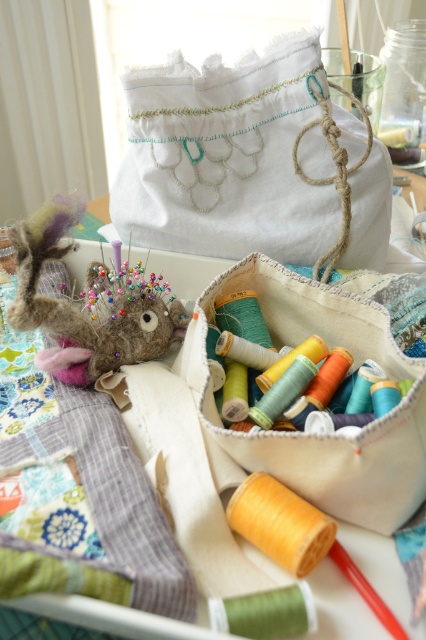
Who is positioned more to the left, white fabric pouch at upper center or fuzzy brown stuffed animal at left?

fuzzy brown stuffed animal at left is more to the left.

Between white fabric pouch at upper center and fuzzy brown stuffed animal at left, which one has less height?

With less height is fuzzy brown stuffed animal at left.

Between point (167, 106) and point (14, 236), which one is positioned behind?

The point (167, 106) is behind.

Where is `white fabric pouch at upper center`? This screenshot has width=426, height=640. white fabric pouch at upper center is located at coordinates (252, 163).

Does point (293, 300) come farther from viewer compared to point (43, 225)?

Yes, it is.

At what (x,y) coordinates should I click in order to perform the action: click on canvas spools at center. Please return your answer as a coordinate pair (x, y). This screenshot has width=426, height=640. Looking at the image, I should click on (319, 436).

This screenshot has width=426, height=640. Identify the location of canvas spools at center. (319, 436).

Does point (189, 122) come farther from viewer compared to point (245, 458)?

Yes, point (189, 122) is farther from viewer.

Is white fabric pouch at upper center taller than canvas spools at center?

Indeed, white fabric pouch at upper center has a greater height compared to canvas spools at center.

Who is more distant from viewer, (126, 204) or (411, 372)?

Positioned behind is point (126, 204).

Image resolution: width=426 pixels, height=640 pixels. I want to click on white fabric pouch at upper center, so click(x=252, y=163).